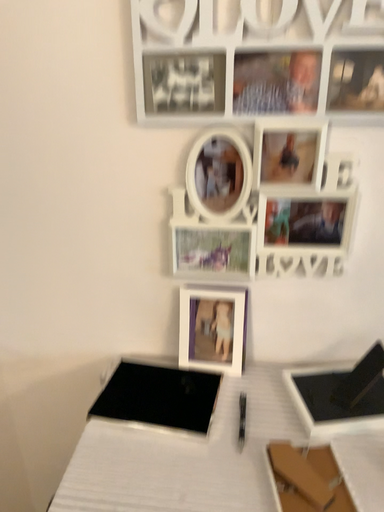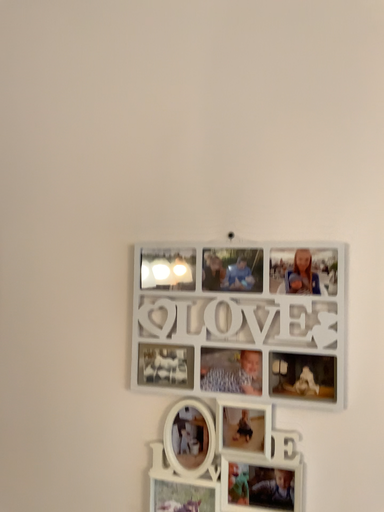
Question: Which way did the camera rotate in the video?

Choices:
 (A) rotated left
 (B) rotated right

Answer: (A)